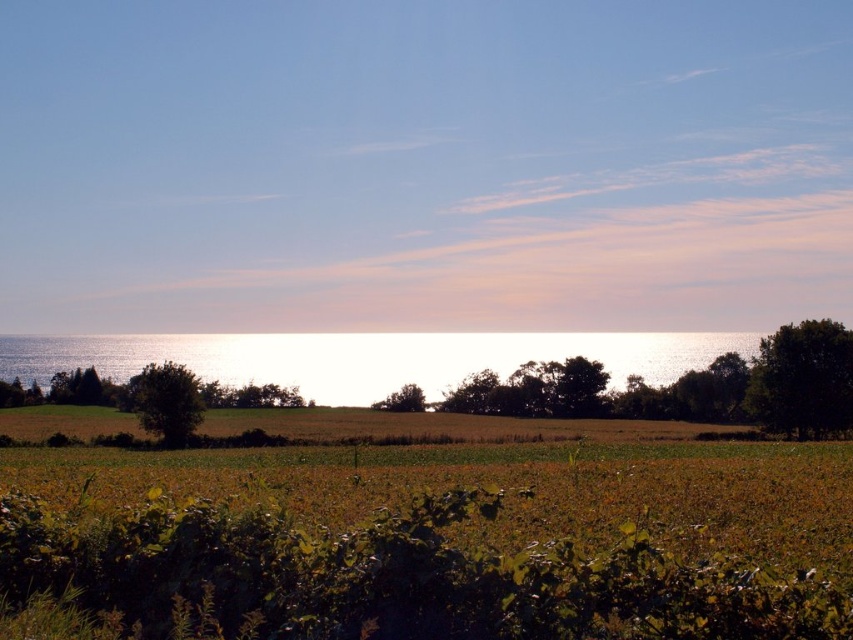
Question: In this image, where is green leafy tree at left located relative to green matte tree at center?

Choices:
 (A) above
 (B) below

Answer: (A)

Question: Considering the real-world distances, which object is farthest from the green leafy tree at right?

Choices:
 (A) green matte tree at center
 (B) green leafy tree at left
 (C) glistening silver water at center

Answer: (C)

Question: Is green leafy tree at right below green matte tree at center?

Choices:
 (A) yes
 (B) no

Answer: (B)

Question: Estimate the real-world distances between objects in this image. Which object is farther from the green leafy tree at left?

Choices:
 (A) glistening silver water at center
 (B) green matte tree at center

Answer: (A)

Question: Which of the following is the farthest from the observer?

Choices:
 (A) green leafy tree at right
 (B) green matte tree at center
 (C) glistening silver water at center

Answer: (B)

Question: Does green leafy tree at left appear over green matte tree at center?

Choices:
 (A) no
 (B) yes

Answer: (B)